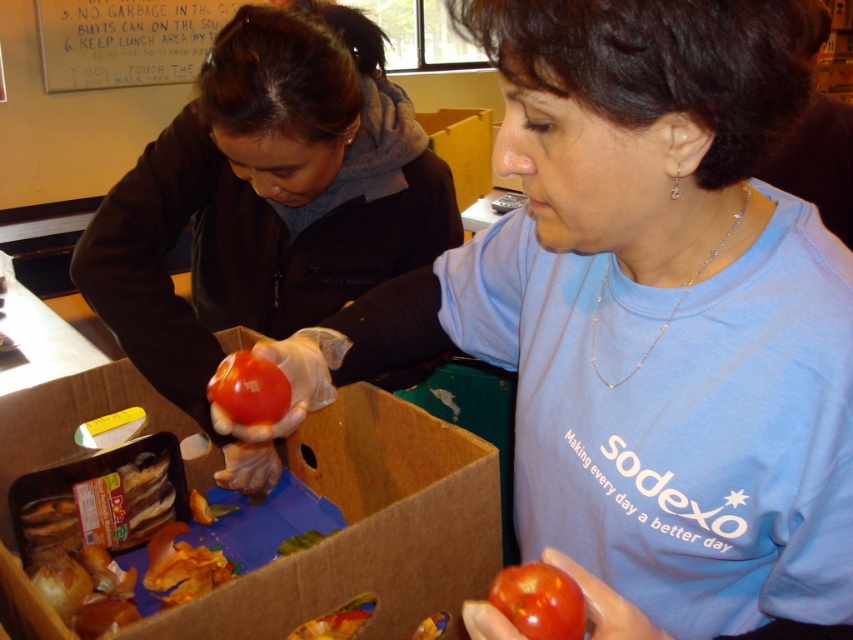
Between brown cardboard box at center and white paperboard at upper left, which one is positioned higher?

white paperboard at upper left is higher up.

Can you confirm if brown cardboard box at center is positioned to the right of white paperboard at upper left?

Indeed, brown cardboard box at center is positioned on the right side of white paperboard at upper left.

Does point (372, 387) lie behind point (131, 45)?

That is False.

You are a GUI agent. You are given a task and a screenshot of the screen. Output one action in this format:
    pyautogui.click(x=<x>, y=<y>)
    Task: Click on the brown cardboard box at center
    This screenshot has height=640, width=853.
    Given the screenshot: What is the action you would take?
    pyautogui.click(x=368, y=529)

Which is above, brown cardboard box at center or glossy red tomato at center?

glossy red tomato at center is above.

Who is more distant from viewer, (393, 516) or (268, 420)?

The point (393, 516) is more distant.

Does point (126, 387) lie in front of point (244, 381)?

No, (126, 387) is further to viewer.

Find the location of `brown cardboard box at center`. brown cardboard box at center is located at coordinates (368, 529).

Is brown cardboard box at center below glossy red tomato at lower center?

Yes.

Is the position of brown cardboard box at center more distant than that of glossy red tomato at lower center?

Yes, brown cardboard box at center is behind glossy red tomato at lower center.

Is point (59, 440) positioned before point (546, 625)?

No.

This screenshot has width=853, height=640. I want to click on brown cardboard box at center, so click(368, 529).